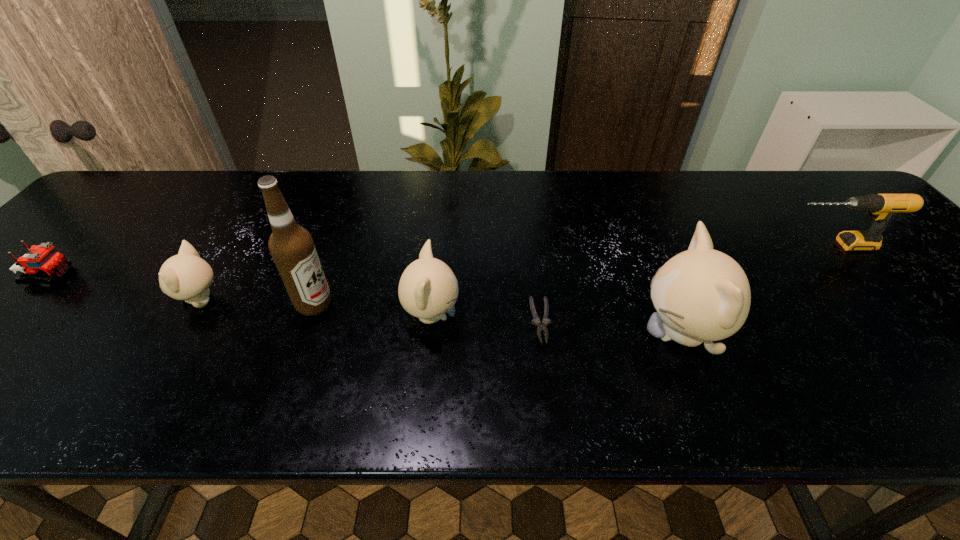
This screenshot has width=960, height=540. I want to click on free space between the rightmost object and the second object from right to left, so click(x=756, y=289).

The height and width of the screenshot is (540, 960). Identify the location of free point between the fifth tallest object and the rightmost object. (516, 272).

Find the location of a particular element. object identified as the fifth closest to the third object from left to right is located at coordinates (701, 295).

Find the location of a particular element. object identified as the second closest to the farthest object is located at coordinates (536, 321).

Locate which kitten ranks third in proximity to the shortest object. Please provide its 2D coordinates. Your answer should be formatted as a tuple, i.e. [(x, y)], where the tuple contains the x and y coordinates of a point satisfying the conditions above.

[(186, 276)]

Identify which kitten is the closest to the shortest object. Please provide its 2D coordinates. Your answer should be formatted as a tuple, i.e. [(x, y)], where the tuple contains the x and y coordinates of a point satisfying the conditions above.

[(428, 288)]

Find the location of `free region that satisfies the following two spatial constraints: 1. on the handle side of the drill; 2. at the gripping part of the fifth object from left to right`. free region that satisfies the following two spatial constraints: 1. on the handle side of the drill; 2. at the gripping part of the fifth object from left to right is located at coordinates (900, 321).

Where is `free spot that satisfies the following two spatial constraints: 1. on the handle side of the farthest object; 2. at the gripping part of the pliers`? free spot that satisfies the following two spatial constraints: 1. on the handle side of the farthest object; 2. at the gripping part of the pliers is located at coordinates (900, 321).